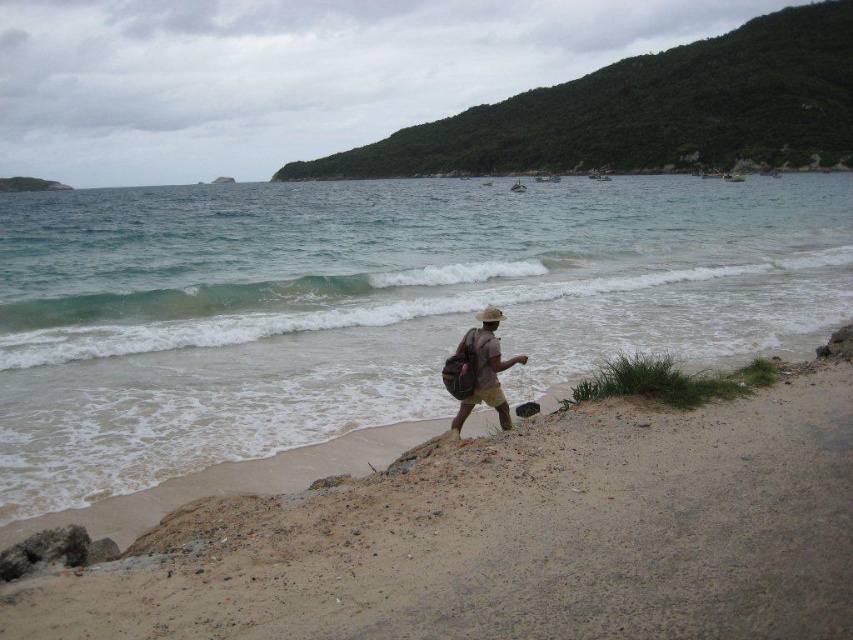
Who is lower down, brown sandy beach at lower center or brown canvas backpack at center?

brown sandy beach at lower center

Which is above, brown sandy beach at lower center or brown canvas backpack at center?

brown canvas backpack at center is higher up.

Which is in front, point (279, 609) or point (444, 371)?

Positioned in front is point (279, 609).

The height and width of the screenshot is (640, 853). What are the coordinates of `brown sandy beach at lower center` in the screenshot? It's located at (514, 538).

Who is taller, clear blue water at center or brown canvas backpack at center?

clear blue water at center

Measure the distance between clear blue water at center and brown canvas backpack at center.

58.54 meters

I want to click on clear blue water at center, so click(x=368, y=305).

Which is above, clear blue water at center or brown sandy beach at lower center?

clear blue water at center is higher up.

Does clear blue water at center have a lesser width compared to brown sandy beach at lower center?

No.

Who is more distant from viewer, (370, 337) or (787, 497)?

The point (370, 337) is behind.

Locate an element on the screen. Image resolution: width=853 pixels, height=640 pixels. clear blue water at center is located at coordinates (368, 305).